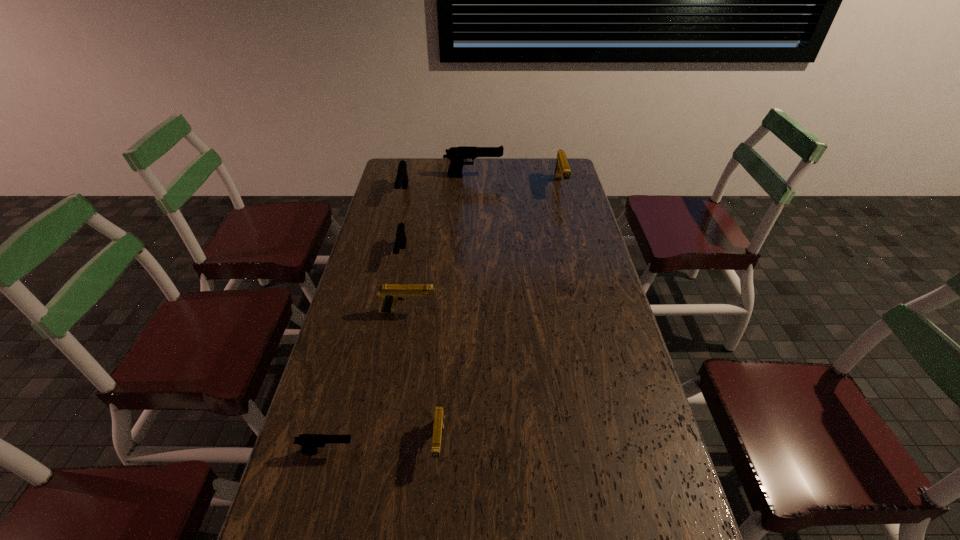
Image resolution: width=960 pixels, height=540 pixels. I want to click on the farthest black pistol, so click(x=456, y=155).

Locate an element on the screen. The height and width of the screenshot is (540, 960). the rightmost black pistol is located at coordinates click(456, 155).

The height and width of the screenshot is (540, 960). In order to click on the rightmost pistol in this screenshot , I will do `click(562, 169)`.

The width and height of the screenshot is (960, 540). In order to click on the farthest tan pistol in this screenshot , I will do `click(562, 169)`.

Where is `the third nearest black pistol`? This screenshot has width=960, height=540. the third nearest black pistol is located at coordinates (402, 177).

Identify the location of the fifth farthest pistol. (390, 294).

You are a GUI agent. You are given a task and a screenshot of the screen. Output one action in this format:
    pyautogui.click(x=<x>, y=<y>)
    Task: Click on the second farthest tan pistol
    
    Given the screenshot: What is the action you would take?
    pyautogui.click(x=390, y=294)

Locate an element on the screen. This screenshot has width=960, height=540. the fourth farthest pistol is located at coordinates (400, 242).

What are the coordinates of `the third biggest black pistol` in the screenshot? It's located at tap(400, 242).

The image size is (960, 540). I want to click on the smallest tan pistol, so click(439, 416).